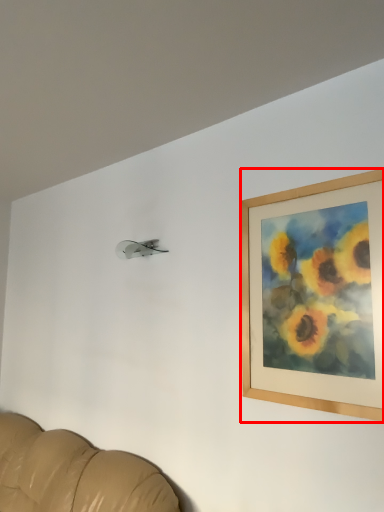
Question: From the image's perspective, what is the correct spatial positioning of picture frame (annotated by the red box) in reference to furniture?

Choices:
 (A) below
 (B) above

Answer: (B)